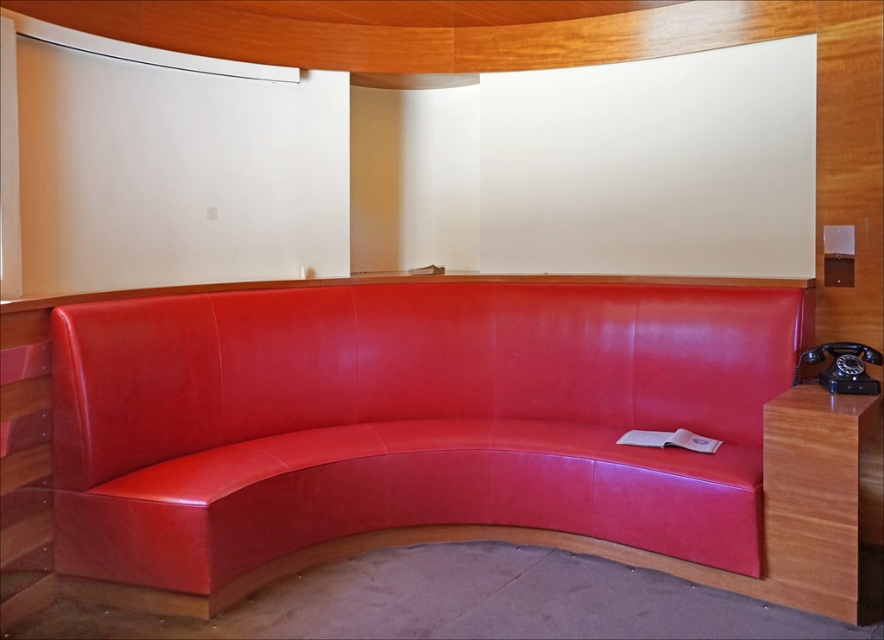
You are sitting on the curved red leather bench and want to place your black rubberized phone at right on the matte leather couch at center. Which direction should you move the phone to reach the couch?

The matte leather couch at center is to the left of the black rubberized phone at right. Therefore, you should move the phone to the left to place it on the matte leather couch at center.

You are sitting on the floor and want to place the black rubberized phone at right onto the matte leather couch at center. Can you reach the couch without standing up?

The matte leather couch at center has a greater height compared to the black rubberized phone at right. Since the couch is taller, you might need to stand up to place the phone on it.